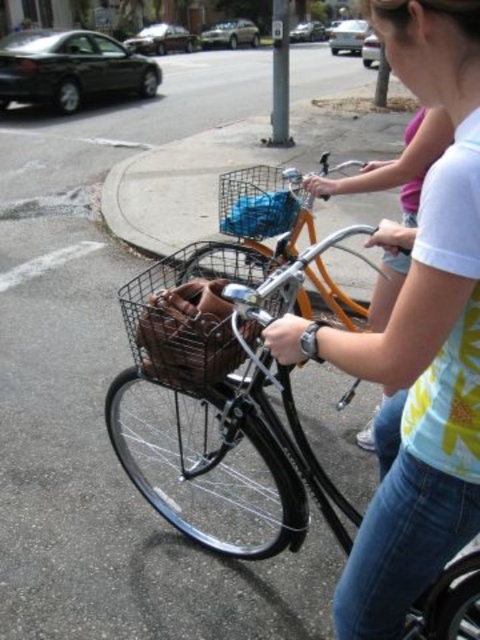
You are a delivery person who needs to choose between the woven brown basket at center and the wire mesh basket at center for carrying a large package. Which basket is wider and better suited for the task?

The wire mesh basket at center is wider than the woven brown basket at center, making it better suited for carrying a large package.

You are a delivery person on a bicycle and need to deliver a package. You see two points marked in the scene. The first point is at coordinates point (144, 324) and the second point is at point (242, 195). Which point is closer to you as you ride towards the direction of the street?

Point (144, 324) is in front of point (242, 195), so it is closer to you as you ride towards the direction of the street.

Consider the image. Where is the woven brown basket at center located in the image?

The woven brown basket at center is located at point (186, 317) in the image.